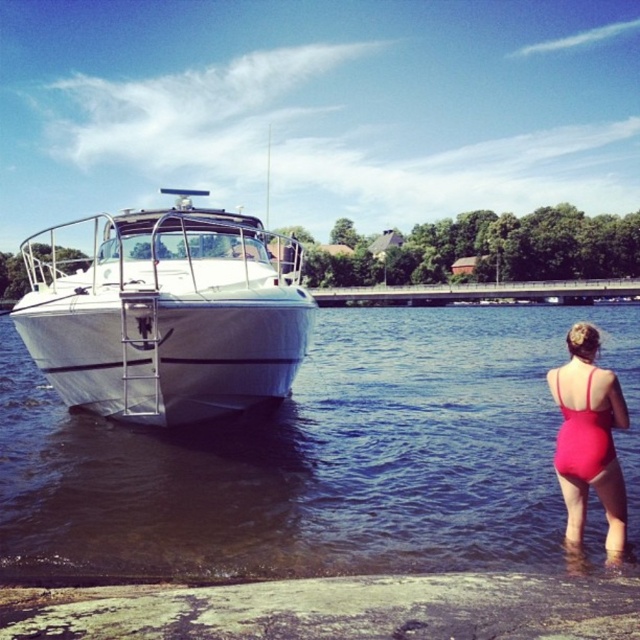
Between clear water at boat right and smooth concrete shore at lower center, which one is positioned higher?

Positioned higher is clear water at boat right.

Which is below, clear water at boat right or smooth concrete shore at lower center?

Positioned lower is smooth concrete shore at lower center.

The image size is (640, 640). Identify the location of clear water at boat right. click(320, 458).

Which of these two, clear water at boat right or matte red swimsuit at lower right, stands taller?

With more height is clear water at boat right.

Does point (493, 467) come in front of point (566, 385)?

No.

Locate an element on the screen. The image size is (640, 640). clear water at boat right is located at coordinates (320, 458).

Is clear water at boat right positioned before white glossy boat at left?

Yes.

Is clear water at boat right wider than white glossy boat at left?

Correct, the width of clear water at boat right exceeds that of white glossy boat at left.

Locate an element on the screen. This screenshot has height=640, width=640. clear water at boat right is located at coordinates (320, 458).